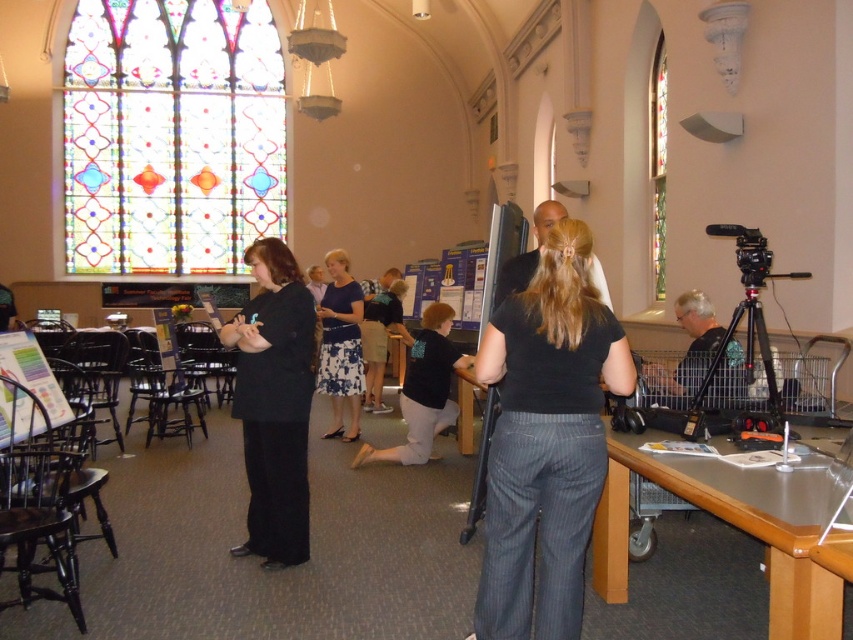
Question: Does stained glass window at upper left have a greater width compared to metallic gray table at lower right?

Choices:
 (A) yes
 (B) no

Answer: (A)

Question: Which object is farther from the camera taking this photo?

Choices:
 (A) metallic gray table at lower right
 (B) black pinstripe pants at center

Answer: (B)

Question: Which point is closer to the camera?

Choices:
 (A) stained glass window at upper left
 (B) black matte/black pants at center

Answer: (B)

Question: Can you confirm if black pinstripe pants at center is positioned above black matte/black pants at center?

Choices:
 (A) no
 (B) yes

Answer: (A)

Question: In this image, where is stained glass window at upper left located relative to metallic gray table at lower right?

Choices:
 (A) left
 (B) right

Answer: (A)

Question: Which object appears closest to the camera in this image?

Choices:
 (A) blue floral dress at center
 (B) black pinstripe pants at center
 (C) black matte/black pants at center
 (D) metallic gray table at lower right

Answer: (D)